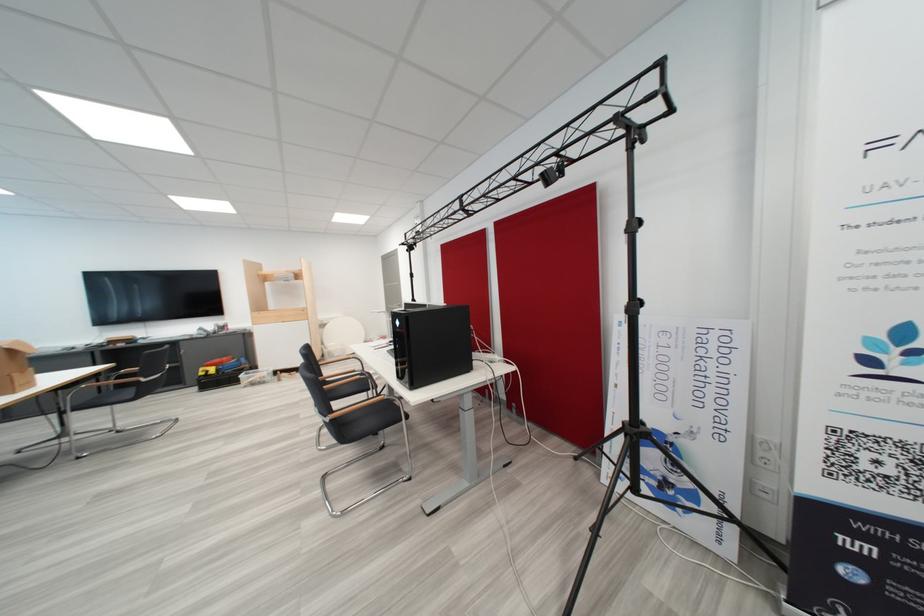
Which object does [687,418] point to?

It corresponds to the white hackathon sign in the image.